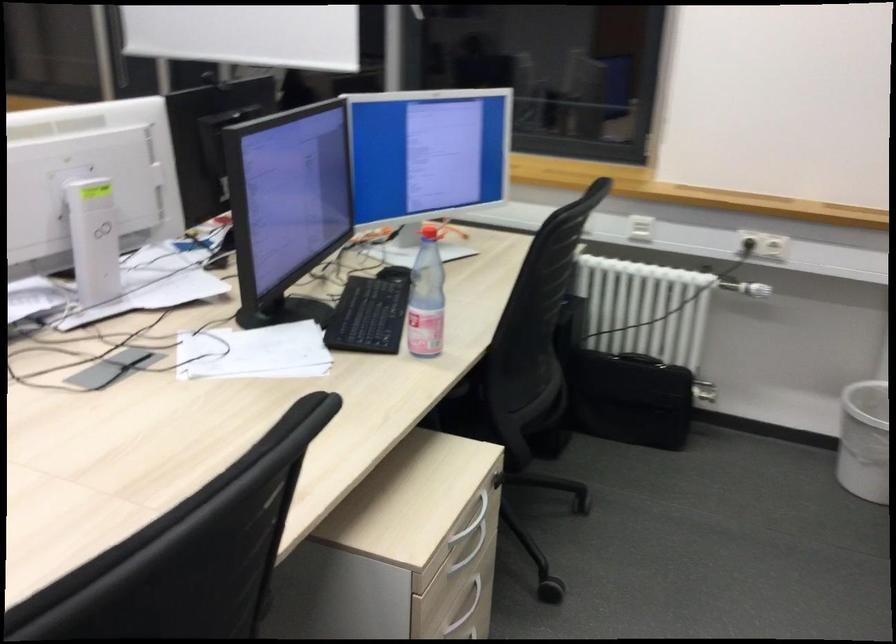
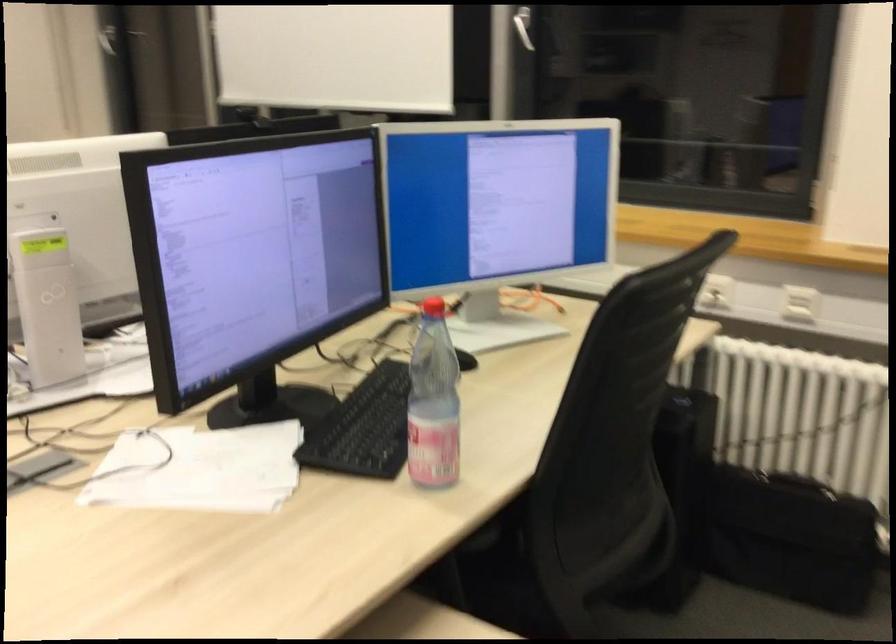
Question: How did the camera likely rotate?

Choices:
 (A) Left
 (B) Right
 (C) Up
 (D) Down

Answer: (A)